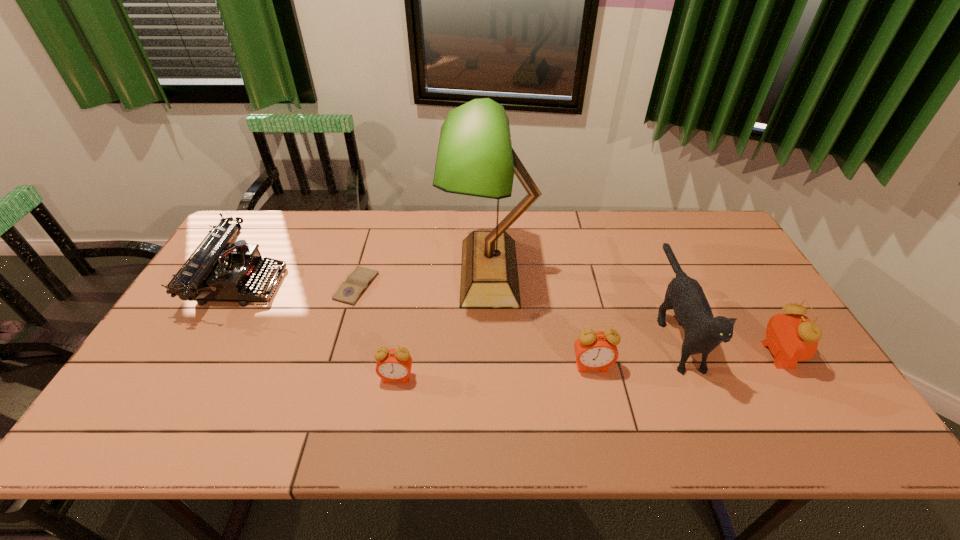
Image resolution: width=960 pixels, height=540 pixels. In order to click on vacant spot to place a alarm clock on the left in this screenshot , I will do `click(192, 390)`.